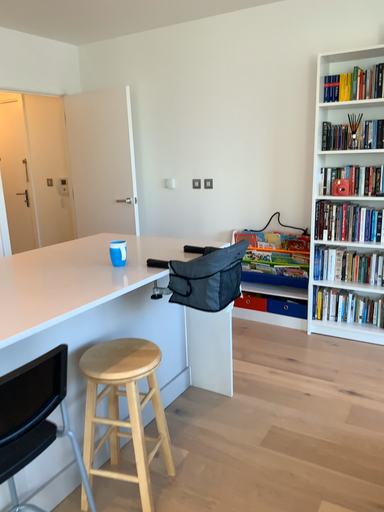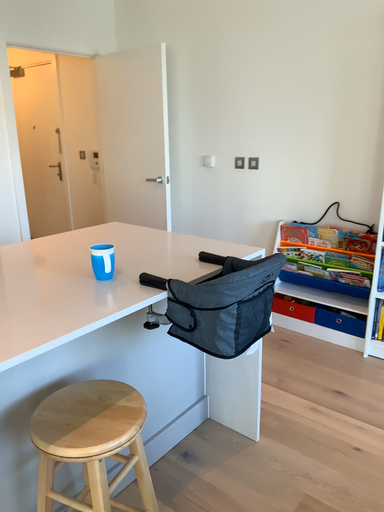
Question: Which way did the camera rotate in the video?

Choices:
 (A) rotated left
 (B) rotated right

Answer: (A)